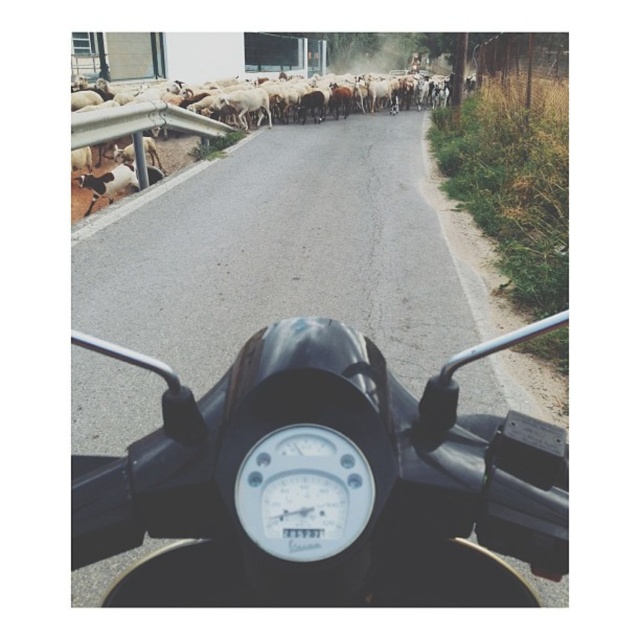
Question: Which of the following is the closest to the observer?

Choices:
 (A) black matte motorcycle at center
 (B) white woolen sheep at upper left

Answer: (A)

Question: Is black matte motorcycle at center bigger than white woolen sheep at upper left?

Choices:
 (A) no
 (B) yes

Answer: (A)

Question: Is black matte motorcycle at center below white woolen sheep at upper left?

Choices:
 (A) yes
 (B) no

Answer: (A)

Question: Which of the following is the closest to the observer?

Choices:
 (A) white woolen sheep at upper left
 (B) black matte motorcycle at center

Answer: (B)

Question: Is black matte motorcycle at center above white woolen sheep at upper left?

Choices:
 (A) yes
 (B) no

Answer: (B)